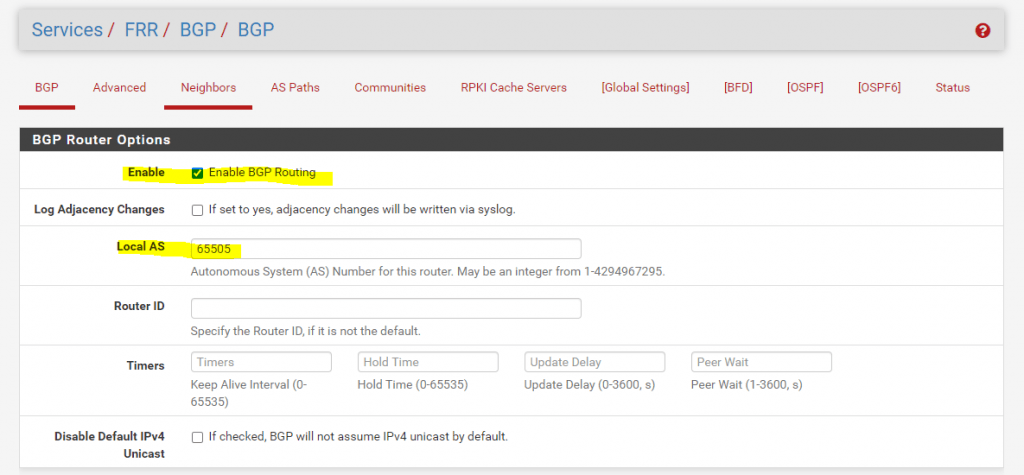
The height and width of the screenshot is (475, 1024). In order to click on write-in text boxes in this screenshot , I will do click(367, 243), click(280, 308), click(287, 357), click(441, 364), click(564, 357), click(762, 362).